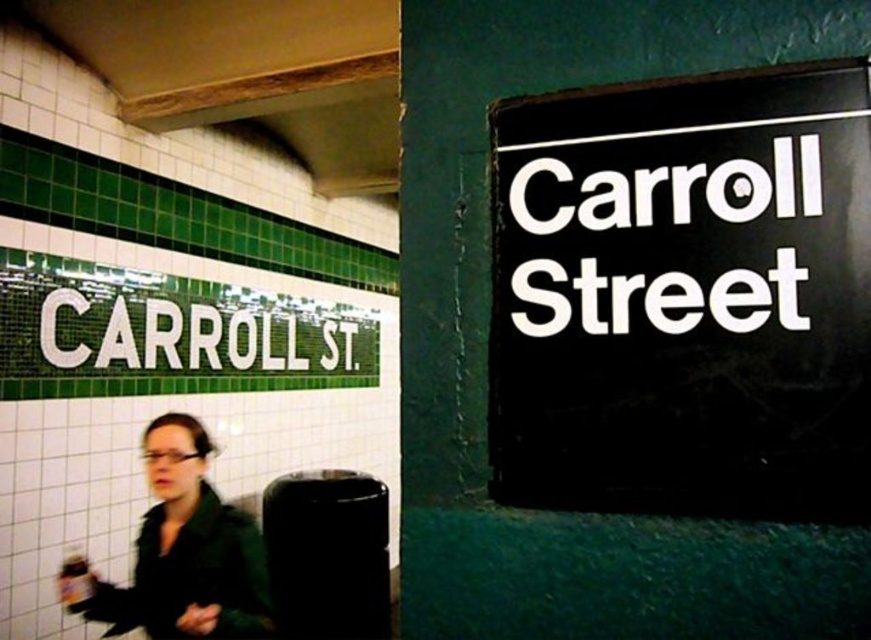
Who is more distant from viewer, (x=608, y=381) or (x=152, y=445)?

The point (x=152, y=445) is behind.

Identify the location of black plastic sign at upper right. (684, 294).